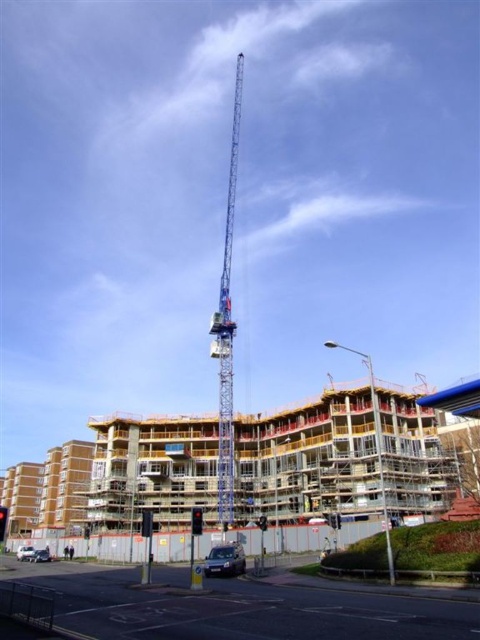
You are a delivery driver who needs to back your truck into the space between the silver metallic car at lower left and the shiny silver car at lower left. Your truck is 3 meters long. Can you safely maneuver your truck into that space without hitting either car?

The space between the silver metallic car at lower left and the shiny silver car at lower left is 2.83 meters. Since your truck is 3 meters long, it is slightly longer than the available space. You may not be able to safely maneuver the truck into that space without risking a collision with one of the cars.

You are a pedestrian standing at the sidewalk near the construction site. You see the metallic silver car at lower center and the shiny silver car at lower left. Which car is closer to you?

The metallic silver car at lower center is closer to you because it is in front of the shiny silver car at lower left.

You are standing at the center of the construction site and want to reach the silver metallic car at lower left. Which direction should you walk to get there?

You should walk towards the lower left direction to reach the silver metallic car at lower left as it is located at point (x=25, y=552).